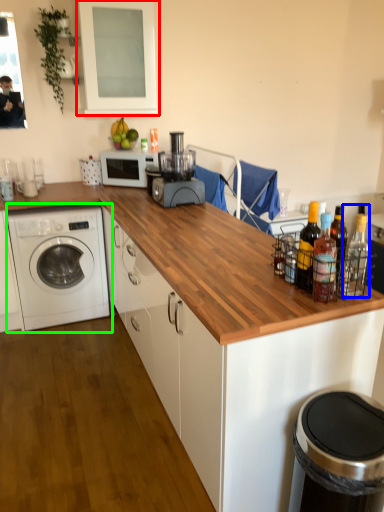
Question: Which object is the farthest from window screen (highlighted by a red box)? Choose among these: bottle (highlighted by a blue box) or washing machine (highlighted by a green box).

Choices:
 (A) bottle
 (B) washing machine

Answer: (A)